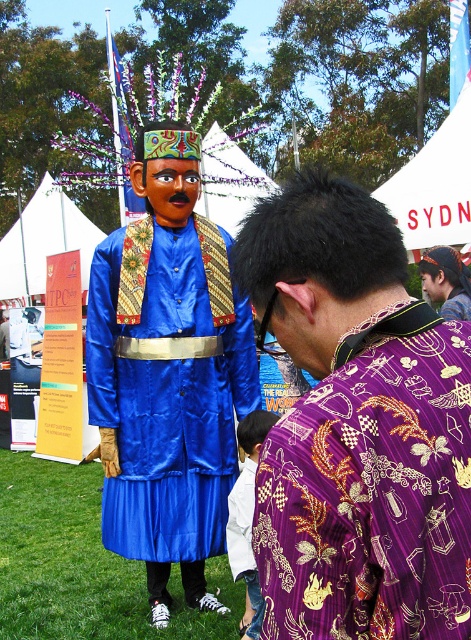
You are attending a cultural festival and see two people dressed in traditional clothing. One is wearing a blue satin robe at left and the other a purple batik shirt at center. Which person is standing to the left of the other?

The blue satin robe at left is positioned on the left side of the purple batik shirt at center, so the person wearing the blue satin robe at left is standing to the left of the person in the purple batik shirt at center.

You are a photographer at the event and want to capture both the blue satin figure at left and the blue satin robe at left in a single photo. However, you notice that focusing on one makes the other blurry. Which object should you focus on to ensure the one closer to you is sharp?

The blue satin figure at left is in front of the blue satin robe at left, so you should focus on the blue satin figure at left to ensure the closer object is sharp.

You are a photographer at the event and want to capture both the blue satin robe at left and the white cotton shirt at lower center in a single frame. Which clothing item should you focus on first to ensure both are in the frame?

Since the blue satin robe at left is taller than the white cotton shirt at lower center, you should focus on the blue satin robe at left first to ensure both are in the frame.